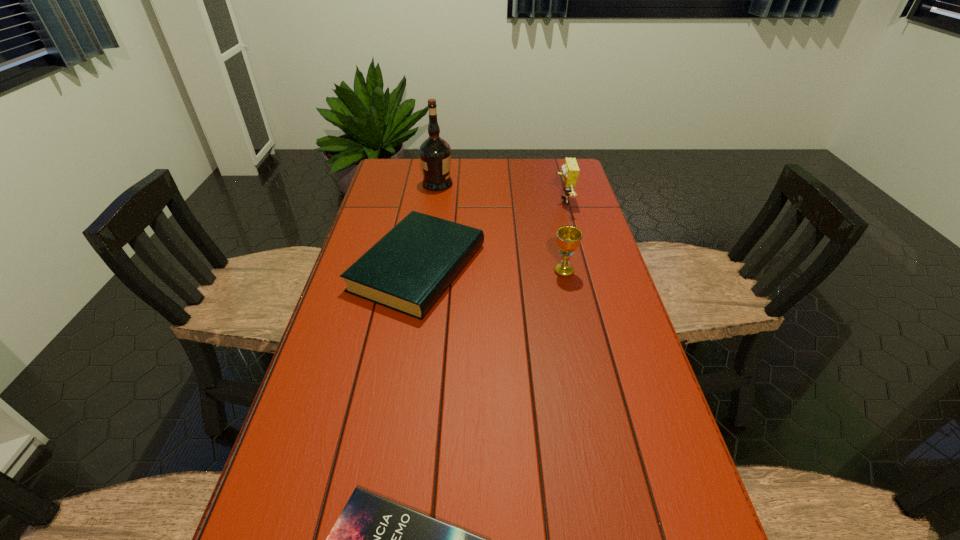
At what (x,y) coordinates should I click in order to perform the action: click on vacant space located 0.070m on the back of the farther hardback book. Please return your answer as a coordinate pair (x, y). Looking at the image, I should click on (427, 213).

Find the location of a particular element. The height and width of the screenshot is (540, 960). liquor at the far edge is located at coordinates (435, 153).

This screenshot has height=540, width=960. I want to click on sponge positioned at the far edge, so click(x=570, y=170).

Where is `object positioned at the left edge`? This screenshot has height=540, width=960. object positioned at the left edge is located at coordinates point(408,270).

Image resolution: width=960 pixels, height=540 pixels. Find the location of `sponge located in the right edge section of the desktop`. sponge located in the right edge section of the desktop is located at coordinates coord(570,170).

You are a GUI agent. You are given a task and a screenshot of the screen. Output one action in this format:
    pyautogui.click(x=<x>, y=<y>)
    Task: Click on the chalice present at the right edge
    
    Given the screenshot: What is the action you would take?
    pyautogui.click(x=568, y=237)

Identify the location of object that is at the far right corner. Image resolution: width=960 pixels, height=540 pixels. (570, 170).

This screenshot has height=540, width=960. I want to click on free space at the far edge of the desktop, so click(x=521, y=182).

Locate an element on the screen. The height and width of the screenshot is (540, 960). vacant region at the left edge is located at coordinates (321, 442).

Identify the location of blank space at the right edge of the desktop. (642, 423).